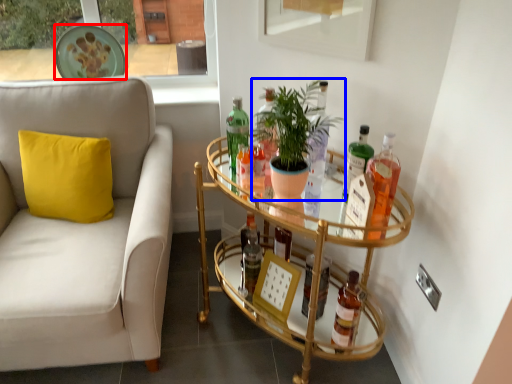
Question: Which of the following is the farthest to the observer, plate (highlighted by a red box) or houseplant (highlighted by a blue box)?

Choices:
 (A) plate
 (B) houseplant

Answer: (A)